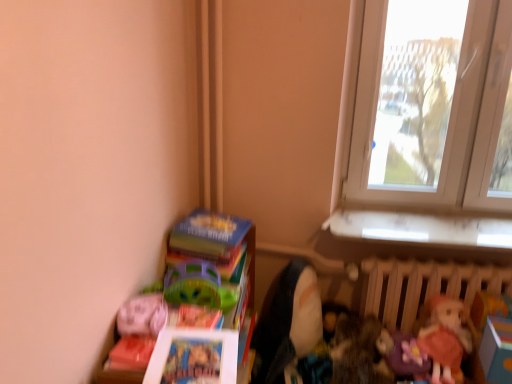
Question: In the image, is matte plastic books at lower left on the left side or the right side of hardcover book at lower left?

Choices:
 (A) right
 (B) left

Answer: (B)

Question: Does point (145, 377) appear closer or farther from the camera than point (169, 241)?

Choices:
 (A) farther
 (B) closer

Answer: (B)

Question: Based on their relative distances, which object is farther from the matte plastic books at lower left?

Choices:
 (A) matte pink doll at lower right, arranged as the second doll when viewed from the left
 (B) soft plush doll at lower right, which is counted as the 2th doll, starting from the right
 (C) matte pink plush at lower left
 (D) white plastic window at upper right
 (E) hardcover book at lower left

Answer: (D)

Question: Which of these objects is positioned farthest from the white plastic window at upper right?

Choices:
 (A) soft plush doll at lower right, which is the 1th doll in left-to-right order
 (B) hardcover book at lower left
 (C) matte plastic books at lower left
 (D) matte pink doll at lower right, which appears as the 1th doll when viewed from the right
 (E) wooden radiator at lower right

Answer: (C)